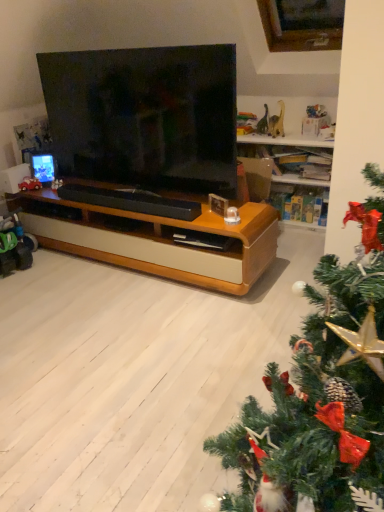
Question: Is the depth of black matte soundbar at center less than that of green plastic toy at left, the 1th toy viewed from the front?

Choices:
 (A) yes
 (B) no

Answer: (A)

Question: Is green plastic toy at left, the 1th toy viewed from the front, surrounded by black matte soundbar at center?

Choices:
 (A) no
 (B) yes

Answer: (A)

Question: Is black matte soundbar at center with green plastic toy at left, the 2th toy from the top?

Choices:
 (A) no
 (B) yes

Answer: (A)

Question: Are black matte soundbar at center and green plastic toy at left, which ranks as the 2th toy in back-to-front order, far apart?

Choices:
 (A) yes
 (B) no

Answer: (B)

Question: Does black matte soundbar at center have a larger size compared to green plastic toy at left, the 1th toy viewed from the front?

Choices:
 (A) no
 (B) yes

Answer: (A)

Question: From the image's perspective, relative to black matte soundbar at center, is green plastic toy at left, placed as the 1th toy when sorted from bottom to top, above or below?

Choices:
 (A) above
 (B) below

Answer: (B)

Question: Is point (11, 228) positioned closer to the camera than point (155, 203)?

Choices:
 (A) closer
 (B) farther

Answer: (B)

Question: Is green plastic toy at left, the 2th toy from the top, to the left or to the right of black matte soundbar at center in the image?

Choices:
 (A) right
 (B) left

Answer: (B)

Question: From a real-world perspective, is green plastic toy at left, which ranks as the 2th toy in back-to-front order, above or below black matte soundbar at center?

Choices:
 (A) above
 (B) below

Answer: (B)

Question: In terms of width, does green plastic toy at left, placed as the 1th toy when sorted from bottom to top, look wider or thinner when compared to matte black tv at center?

Choices:
 (A) wide
 (B) thin

Answer: (A)

Question: Visually, is green plastic toy at left, the 1th toy viewed from the front, positioned to the left or to the right of matte black tv at center?

Choices:
 (A) left
 (B) right

Answer: (A)

Question: Considering the positions of green plastic toy at left, the 2th toy from the top, and matte black tv at center in the image, is green plastic toy at left, the 2th toy from the top, taller or shorter than matte black tv at center?

Choices:
 (A) tall
 (B) short

Answer: (B)

Question: Is green plastic toy at left, the 2th toy from the top, inside or outside of matte black tv at center?

Choices:
 (A) outside
 (B) inside

Answer: (A)

Question: From a real-world perspective, is black matte soundbar at center above or below metallic red car at left, which appears as the 1th toy when viewed from the top?

Choices:
 (A) below
 (B) above

Answer: (A)

Question: Visually, is black matte soundbar at center positioned to the left or to the right of metallic red car at left, positioned as the 1th toy in back-to-front order?

Choices:
 (A) left
 (B) right

Answer: (B)